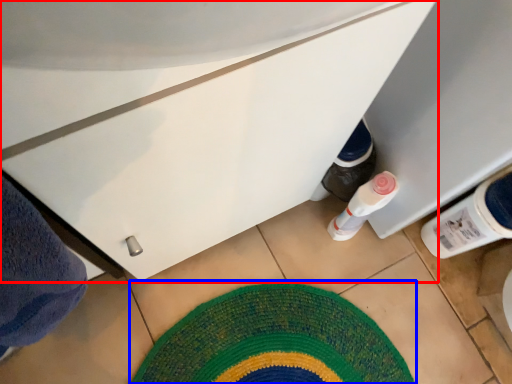
Question: Which of the following is the closest to the observer, cabinetry (highlighted by a red box) or mat (highlighted by a blue box)?

Choices:
 (A) cabinetry
 (B) mat

Answer: (A)